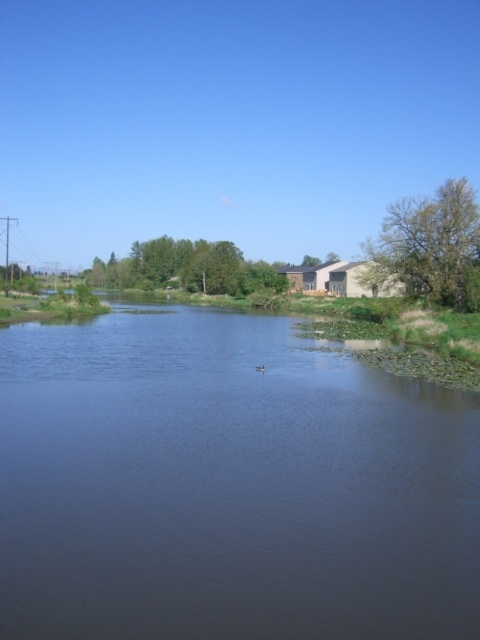
You are a photographer trying to capture the brown fuzzy duck at center in the dark blue water at center. Which object should you focus on first if you want to ensure both are in focus?

The dark blue water at center is much taller than the brown fuzzy duck at center, so you should focus on the taller object first to ensure both are in focus.

You are standing at the riverside and want to place two markers at the coordinates point [322,376] and point [261,371]. Which marker will be closer to your current position?

Point [322,376] is closer to the viewer than point [261,371], so the marker at point [322,376] will be closer to your current position.